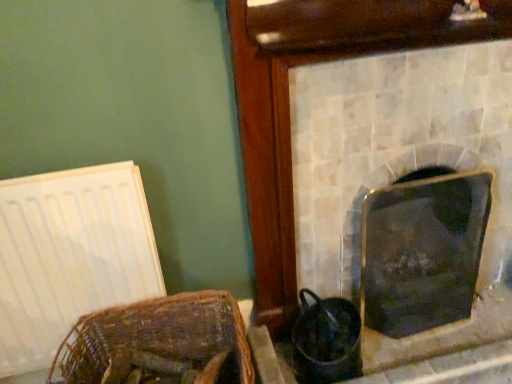
This screenshot has height=384, width=512. Describe the element at coordinates (402, 172) in the screenshot. I see `metallic silver fireplace at center, which is the 2th fireplace in right-to-left order` at that location.

You are a GUI agent. You are given a task and a screenshot of the screen. Output one action in this format:
    pyautogui.click(x=<x>, y=<y>)
    Task: Click on the white matte radiator at left
    Image resolution: width=512 pixels, height=384 pixels.
    Given the screenshot: What is the action you would take?
    tap(70, 256)

You are a GUI agent. You are given a task and a screenshot of the screen. Output one action in this format:
    pyautogui.click(x=<x>, y=<y>)
    Task: Click on the metallic silver fireplace at center, acting as the 1th fireplace starting from the left
    The image size is (512, 384).
    Given the screenshot: What is the action you would take?
    pyautogui.click(x=402, y=172)

Is point (407, 188) closer to camera compared to point (348, 253)?

Yes.

Would you say shiny black glass at right, the second fireplace in the left-to-right sequence, contains metallic silver fireplace at center, which is the 2th fireplace in right-to-left order?

No.

Are shiny black glass at right, the 1th fireplace viewed from the right, and metallic silver fireplace at center, which is the 2th fireplace in right-to-left order, located far from each other?

shiny black glass at right, the 1th fireplace viewed from the right, is actually quite close to metallic silver fireplace at center, which is the 2th fireplace in right-to-left order.

Is shiny black glass at right, the second fireplace in the left-to-right sequence, in front of or behind metallic silver fireplace at center, acting as the 1th fireplace starting from the left, in the image?

In the image, shiny black glass at right, the second fireplace in the left-to-right sequence, appears behind metallic silver fireplace at center, acting as the 1th fireplace starting from the left.

Is woven brown basket at lower left inside or outside of metallic silver fireplace at center, acting as the 1th fireplace starting from the left?

The correct answer is: outside.

How distant is woven brown basket at lower left from metallic silver fireplace at center, which is the 2th fireplace in right-to-left order?

A distance of 26.19 inches exists between woven brown basket at lower left and metallic silver fireplace at center, which is the 2th fireplace in right-to-left order.

From the image's perspective, which one is positioned lower, woven brown basket at lower left or metallic silver fireplace at center, which is the 2th fireplace in right-to-left order?

woven brown basket at lower left is shown below in the image.

Is woven brown basket at lower left positioned with its back to metallic silver fireplace at center, acting as the 1th fireplace starting from the left?

No.

Which of these two, shiny black glass at right, the 1th fireplace viewed from the right, or woven brown basket at lower left, stands shorter?

With less height is woven brown basket at lower left.

Based on the photo, does shiny black glass at right, the 1th fireplace viewed from the right, turn towards woven brown basket at lower left?

No.

Starting from the woven brown basket at lower left, which fireplace is the 2nd one behind? Please provide its 2D coordinates.

[(423, 250)]

Which object is positioned more to the left, woven brown basket at lower left or white matte radiator at left?

From the viewer's perspective, white matte radiator at left appears more on the left side.

From a real-world perspective, is woven brown basket at lower left physically below white matte radiator at left?

Yes, from a real-world perspective, woven brown basket at lower left is under white matte radiator at left.

In terms of size, does woven brown basket at lower left appear bigger or smaller than white matte radiator at left?

Considering their sizes, woven brown basket at lower left takes up more space than white matte radiator at left.

From the image's perspective, is woven brown basket at lower left below white matte radiator at left?

Yes, from the image's perspective, woven brown basket at lower left is below white matte radiator at left.

Is metallic silver fireplace at center, acting as the 1th fireplace starting from the left, wider or thinner than woven brown basket at lower left?

metallic silver fireplace at center, acting as the 1th fireplace starting from the left, is thinner than woven brown basket at lower left.

Which object is further away from the camera, metallic silver fireplace at center, which is the 2th fireplace in right-to-left order, or woven brown basket at lower left?

metallic silver fireplace at center, which is the 2th fireplace in right-to-left order, is further from the camera.

From a real-world perspective, which is physically below, metallic silver fireplace at center, which is the 2th fireplace in right-to-left order, or woven brown basket at lower left?

woven brown basket at lower left.

Considering the sizes of metallic silver fireplace at center, which is the 2th fireplace in right-to-left order, and woven brown basket at lower left in the image, is metallic silver fireplace at center, which is the 2th fireplace in right-to-left order, bigger or smaller than woven brown basket at lower left?

In the image, metallic silver fireplace at center, which is the 2th fireplace in right-to-left order, appears to be larger than woven brown basket at lower left.

Is shiny black glass at right, the second fireplace in the left-to-right sequence, a part of woven brown basket at lower left?

No, shiny black glass at right, the second fireplace in the left-to-right sequence, is located outside of woven brown basket at lower left.

From the image's perspective, between woven brown basket at lower left and shiny black glass at right, the 1th fireplace viewed from the right, which one is located above?

From the image's view, shiny black glass at right, the 1th fireplace viewed from the right, is above.

Which of these two, woven brown basket at lower left or shiny black glass at right, the 1th fireplace viewed from the right, is wider?

shiny black glass at right, the 1th fireplace viewed from the right.

Consider the image. Could you measure the distance between woven brown basket at lower left and shiny black glass at right, the second fireplace in the left-to-right sequence?

The distance of woven brown basket at lower left from shiny black glass at right, the second fireplace in the left-to-right sequence, is 28.74 inches.

Considering the positions of objects white matte radiator at left and woven brown basket at lower left in the image provided, who is more to the left, white matte radiator at left or woven brown basket at lower left?

white matte radiator at left.

Consider the image. Who is smaller, white matte radiator at left or woven brown basket at lower left?

Smaller between the two is white matte radiator at left.

From a real-world perspective, is white matte radiator at left positioned above or below woven brown basket at lower left?

From a real-world perspective, white matte radiator at left is physically above woven brown basket at lower left.

Is point (65, 237) positioned before point (129, 327)?

Yes, it is in front of point (129, 327).

I want to click on fireplace on the left of shiny black glass at right, the 1th fireplace viewed from the right, so click(x=402, y=172).

In order to click on the 1st fireplace behind when counting from the woven brown basket at lower left in this screenshot , I will do pyautogui.click(x=402, y=172).

Looking at the image, which one is located closer to white matte radiator at left, woven brown basket at lower left or metallic silver fireplace at center, acting as the 1th fireplace starting from the left?

woven brown basket at lower left.

Looking at the image, which one is located further to shiny black glass at right, the second fireplace in the left-to-right sequence, white matte radiator at left or woven brown basket at lower left?

white matte radiator at left lies further to shiny black glass at right, the second fireplace in the left-to-right sequence, than the other object.

Which object lies nearer to the anchor point white matte radiator at left, metallic silver fireplace at center, acting as the 1th fireplace starting from the left, or woven brown basket at lower left?

Based on the image, woven brown basket at lower left appears to be nearer to white matte radiator at left.

Considering their positions, is white matte radiator at left positioned further to shiny black glass at right, the 1th fireplace viewed from the right, than metallic silver fireplace at center, acting as the 1th fireplace starting from the left?

Based on the image, white matte radiator at left appears to be further to shiny black glass at right, the 1th fireplace viewed from the right.

From the image, which object appears to be farther from metallic silver fireplace at center, acting as the 1th fireplace starting from the left, white matte radiator at left or shiny black glass at right, the second fireplace in the left-to-right sequence?

A: white matte radiator at left is further to metallic silver fireplace at center, acting as the 1th fireplace starting from the left.

When comparing their distances from shiny black glass at right, the 1th fireplace viewed from the right, does woven brown basket at lower left or white matte radiator at left seem further?

Based on the image, white matte radiator at left appears to be further to shiny black glass at right, the 1th fireplace viewed from the right.

Looking at the image, which one is located further to woven brown basket at lower left, white matte radiator at left or shiny black glass at right, the second fireplace in the left-to-right sequence?

The object further to woven brown basket at lower left is shiny black glass at right, the second fireplace in the left-to-right sequence.

When comparing their distances from woven brown basket at lower left, does metallic silver fireplace at center, which is the 2th fireplace in right-to-left order, or shiny black glass at right, the second fireplace in the left-to-right sequence, seem further?

shiny black glass at right, the second fireplace in the left-to-right sequence, is further to woven brown basket at lower left.

Identify the location of basket between white matte radiator at left and metallic silver fireplace at center, acting as the 1th fireplace starting from the left, in the horizontal direction. click(x=158, y=343).

Find the location of a particular element. basket between white matte radiator at left and shiny black glass at right, the second fireplace in the left-to-right sequence, from left to right is located at coordinates (158, 343).

Image resolution: width=512 pixels, height=384 pixels. What are the coordinates of `fireplace between woven brown basket at lower left and shiny black glass at right, the 1th fireplace viewed from the right` in the screenshot? It's located at (402, 172).

Where is `fireplace between white matte radiator at left and shiny black glass at right, the second fireplace in the left-to-right sequence, in the horizontal direction`? The image size is (512, 384). fireplace between white matte radiator at left and shiny black glass at right, the second fireplace in the left-to-right sequence, in the horizontal direction is located at coordinates (402, 172).